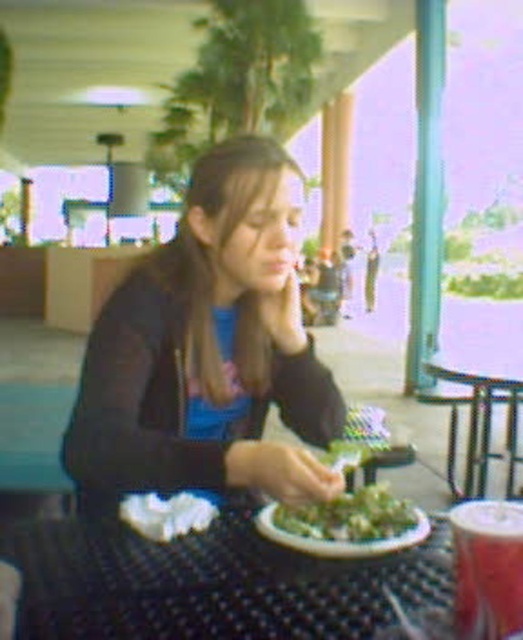
Question: Does metallic silver table at right appear on the left side of white glossy plate at center?

Choices:
 (A) no
 (B) yes

Answer: (A)

Question: Does metallic silver table at right have a larger size compared to white fluffy clouds at center?

Choices:
 (A) yes
 (B) no

Answer: (A)

Question: Can you confirm if black textured table at center is positioned above white glossy plate at center?

Choices:
 (A) yes
 (B) no

Answer: (B)

Question: Which point is farther to the camera?

Choices:
 (A) metallic silver table at right
 (B) white fluffy clouds at center
 (C) white glossy plate at center

Answer: (A)

Question: Which of the following is the closest to the observer?

Choices:
 (A) green leafy salad at center
 (B) metallic silver table at right

Answer: (A)

Question: Which of the following is the closest to the observer?

Choices:
 (A) (104, 636)
 (B) (152, 496)

Answer: (A)